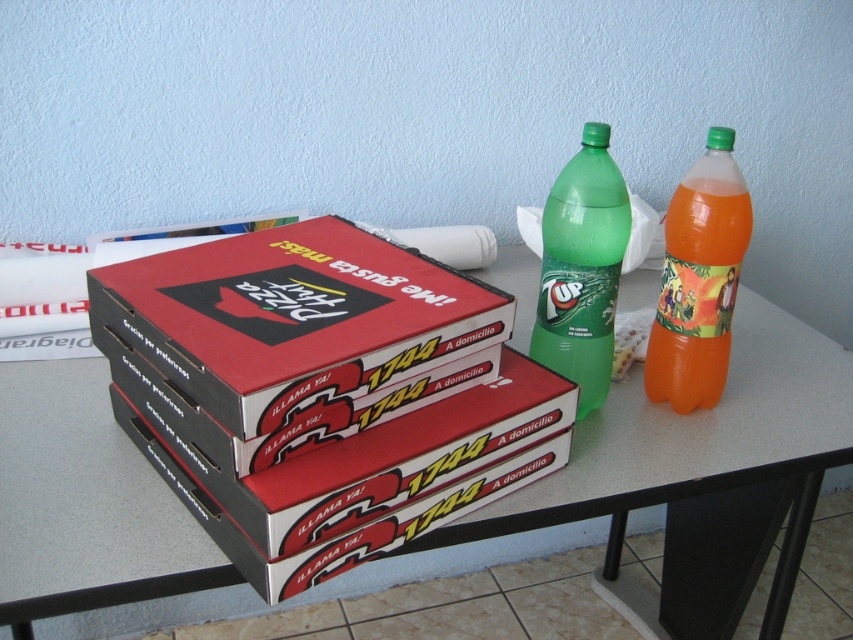
Can you confirm if white glossy table at center is wider than translucent orange bottle at right?

Yes, white glossy table at center is wider than translucent orange bottle at right.

Based on the photo, is white glossy table at center below translucent orange bottle at right?

Correct, white glossy table at center is located below translucent orange bottle at right.

What do you see at coordinates (697, 454) in the screenshot?
I see `white glossy table at center` at bounding box center [697, 454].

I want to click on white glossy table at center, so click(x=697, y=454).

Does translucent orange bottle at right have a lesser width compared to green matte plastic bottle at upper right?

Correct, translucent orange bottle at right's width is less than green matte plastic bottle at upper right's.

Describe the element at coordinates (699, 280) in the screenshot. The height and width of the screenshot is (640, 853). I see `translucent orange bottle at right` at that location.

Image resolution: width=853 pixels, height=640 pixels. I want to click on translucent orange bottle at right, so click(x=699, y=280).

Is white glossy table at center smaller than matte cardboard pizza box at center?

No.

Which is more to the left, white glossy table at center or matte cardboard pizza box at center?

Positioned to the left is matte cardboard pizza box at center.

Which is in front, point (44, 413) or point (241, 339)?

Point (241, 339)

What are the coordinates of `white glossy table at center` in the screenshot? It's located at tap(697, 454).